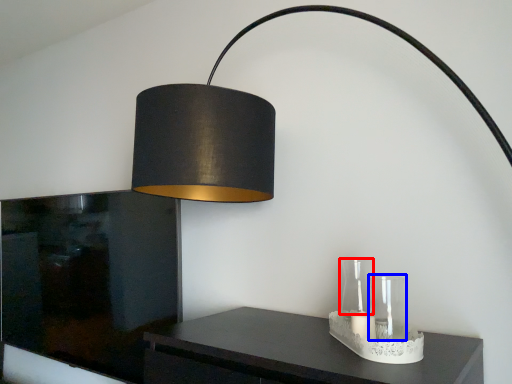
Question: Which point is further to the camera, glass vase (highlighted by a red box) or glass vase (highlighted by a blue box)?

Choices:
 (A) glass vase
 (B) glass vase

Answer: (A)